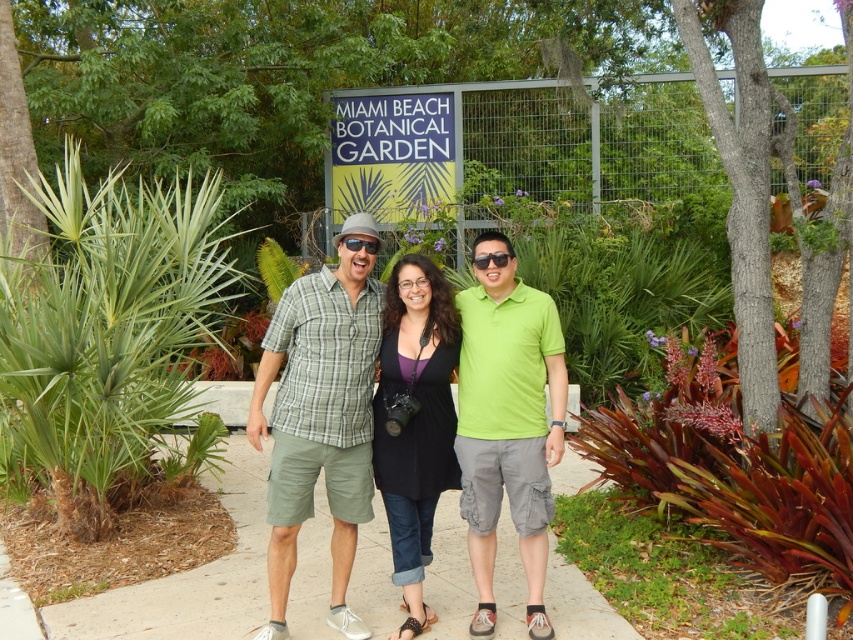
You are a photographer at the Miami Beach Botanical Garden and want to capture a closeup shot of the sunglasses. Which sunglasses are on the left side when looking at the matte black sunglasses at center and the green matte sunglasses at center?

The matte black sunglasses at center is positioned on the left side of green matte sunglasses at center, so the matte black sunglasses at center are on the left side.

You are standing at the point labeled as point [506,260] and want to walk to the point labeled as point [375,243]. Which direction should you move in to reach your destination?

Since point [375,243] is behind point [506,260], you should move backward to reach point [375,243] from point [506,260].

You are a photographer taking a picture of the green leafy plant at left and the black matte dress at center. Which object is higher in the frame?

The green leafy plant at left is above the black matte dress at center, so it is higher in the frame.